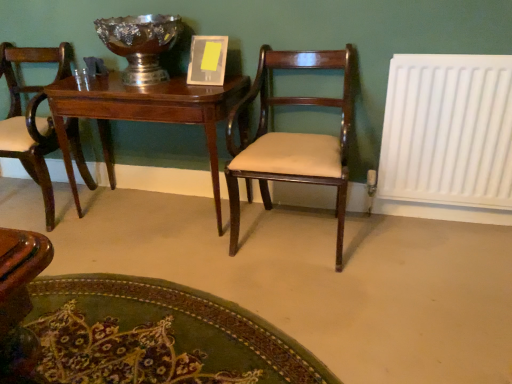
The width and height of the screenshot is (512, 384). Find the location of `free space that is to the left of white plastic radiator at right`. free space that is to the left of white plastic radiator at right is located at coordinates (380, 241).